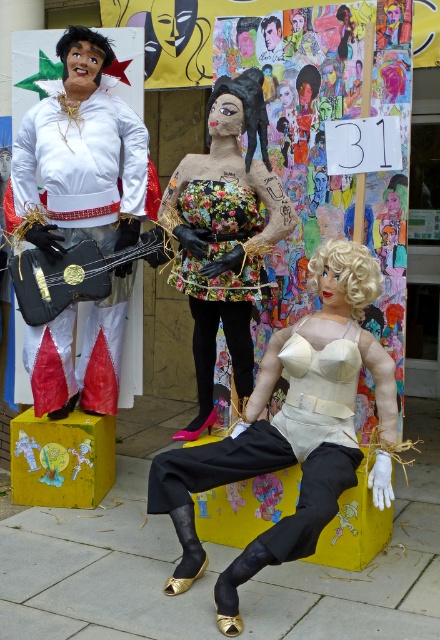
Question: Which of the following is the farthest from the observer?

Choices:
 (A) (80, 220)
 (B) (268, 208)

Answer: (A)

Question: Does matte beige bust at center appear over matte black guitar at left?

Choices:
 (A) no
 (B) yes

Answer: (A)

Question: Is matte beige bust at center to the left of blonde synthetic wig at center from the viewer's perspective?

Choices:
 (A) yes
 (B) no

Answer: (A)

Question: Can you confirm if matte black guitar at left is wider than floral fabric dress at center?

Choices:
 (A) no
 (B) yes

Answer: (B)

Question: Which object is the closest to the matte beige bust at center?

Choices:
 (A) floral fabric dress at center
 (B) blonde synthetic wig at center

Answer: (B)

Question: Which object appears farthest from the camera in this image?

Choices:
 (A) matte black guitar at left
 (B) floral fabric dress at center

Answer: (A)